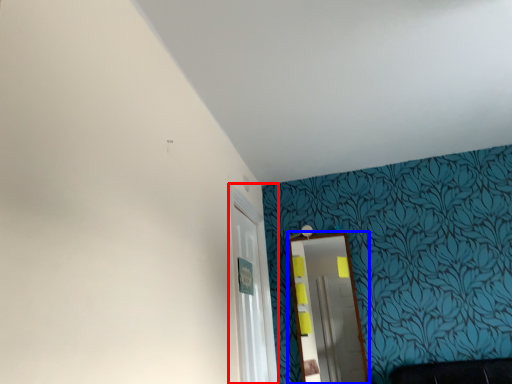
Question: Which object appears closest to the camera in this image, glass door (highlighted by a red box) or mirror (highlighted by a blue box)?

Choices:
 (A) glass door
 (B) mirror

Answer: (A)